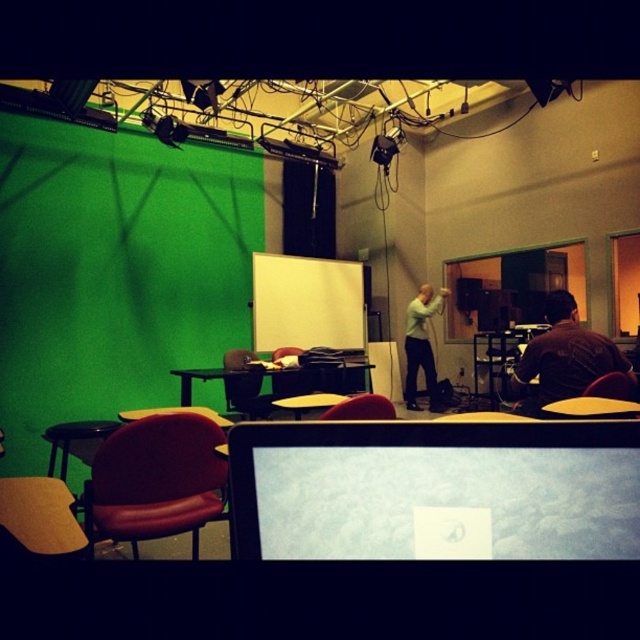
Question: Which point appears closest to the camera in this image?

Choices:
 (A) (275, 372)
 (B) (278, 352)
 (C) (348, 328)
 (D) (35, 552)

Answer: (D)

Question: From the image, what is the correct spatial relationship of light gray sweater at center in relation to leather at right?

Choices:
 (A) right
 (B) left

Answer: (B)

Question: Can you confirm if matte black table at center is positioned to the right of matte plastic table at center?

Choices:
 (A) no
 (B) yes

Answer: (B)

Question: Which is farther from the red leather chair at center?

Choices:
 (A) leather at right
 (B) light gray sweater at center
 (C) leather-like red chair at center

Answer: (B)

Question: Which of the following is the closest to the observer?

Choices:
 (A) (280, 397)
 (B) (349, 289)

Answer: (A)

Question: Can you confirm if yellow matte table at center is positioned below matte black table at center?

Choices:
 (A) yes
 (B) no

Answer: (B)